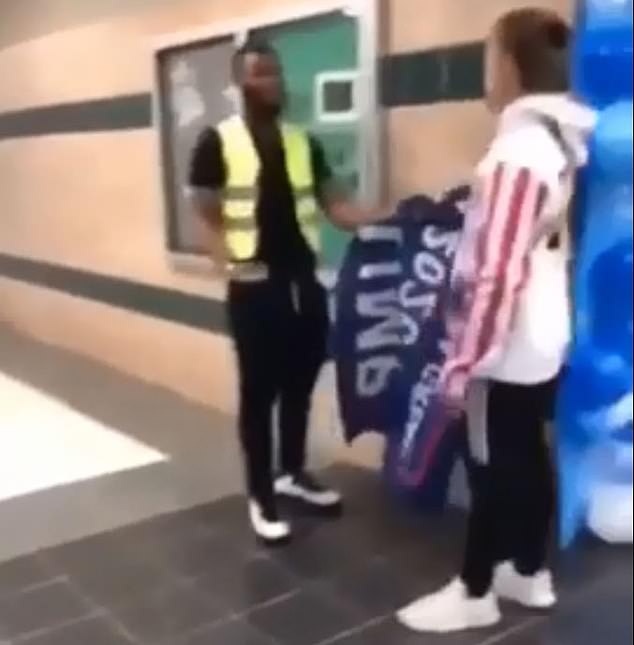
Where is `light brown wall to the right`? The image size is (634, 645). light brown wall to the right is located at coordinates (112, 168).